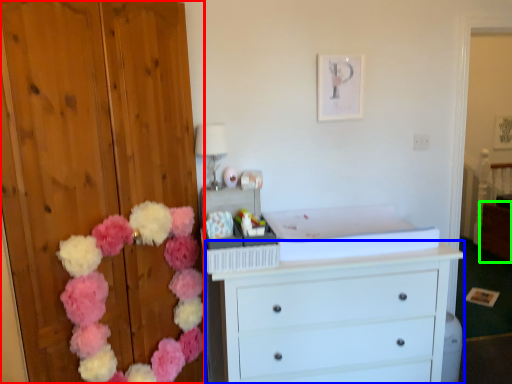
Question: Which is farther away from dresser (highlighted by a red box)? chest of drawers (highlighted by a blue box) or cabinetry (highlighted by a green box)?

Choices:
 (A) chest of drawers
 (B) cabinetry

Answer: (B)